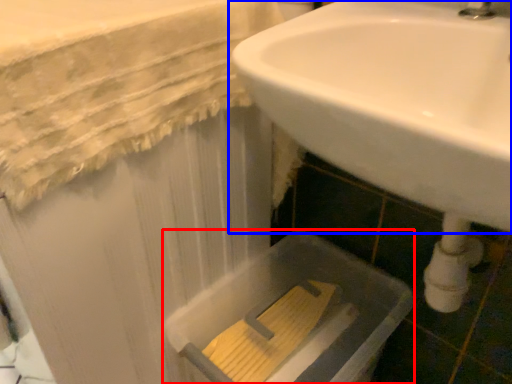
Question: Which point is further to the camera, bath (highlighted by a red box) or sink (highlighted by a blue box)?

Choices:
 (A) bath
 (B) sink

Answer: (A)